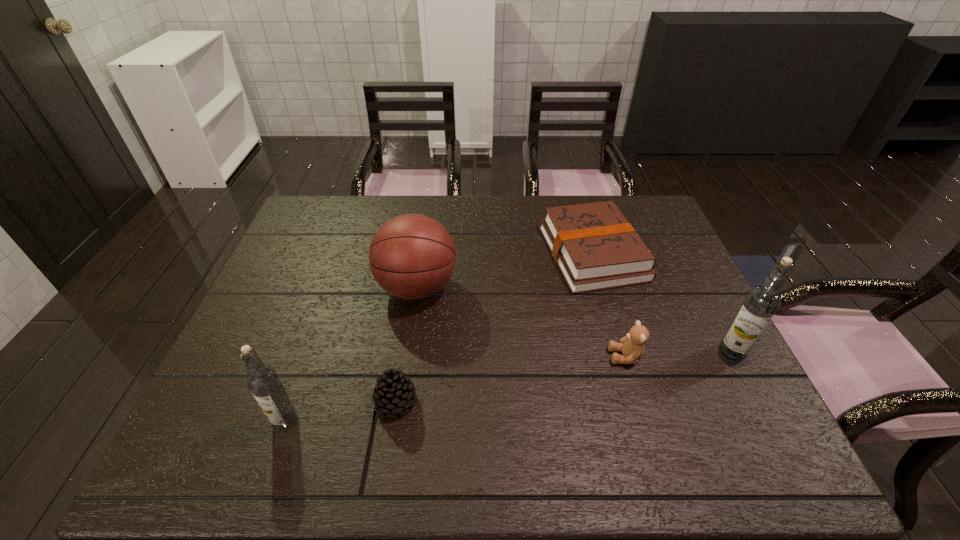
At what (x,y) coordinates should I click in order to perform the action: click on pinecone positioned at the near edge. Please return your answer as a coordinate pair (x, y). This screenshot has width=960, height=540. Looking at the image, I should click on (394, 392).

Find the location of a particular element. The height and width of the screenshot is (540, 960). vodka present at the right edge is located at coordinates (761, 303).

Where is `hardback book present at the right edge`? hardback book present at the right edge is located at coordinates (595, 247).

This screenshot has height=540, width=960. Identify the location of object at the far right corner. (595, 247).

Where is `free space at the far edge of the desktop`? free space at the far edge of the desktop is located at coordinates (369, 203).

Locate an element on the screen. Image resolution: width=960 pixels, height=540 pixels. free region at the left edge of the desktop is located at coordinates (272, 293).

Locate an element on the screen. blank space at the right edge of the desktop is located at coordinates (681, 309).

You are a GUI agent. You are given a task and a screenshot of the screen. Output one action in this format:
    pyautogui.click(x=<x>, y=<y>)
    Task: Click on the free space at the far left corner
    
    Given the screenshot: What is the action you would take?
    pyautogui.click(x=318, y=216)

This screenshot has height=540, width=960. I want to click on vacant area that lies between the leftmost object and the pinecone, so click(341, 411).

Find the location of a particular element. This screenshot has width=960, height=540. empty location between the basketball and the shortest object is located at coordinates (505, 271).